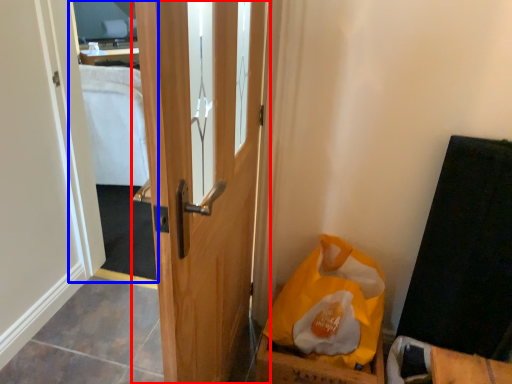
Question: Which object appears closest to the camera in this image, door (highlighted by a red box) or mirror (highlighted by a blue box)?

Choices:
 (A) door
 (B) mirror

Answer: (A)